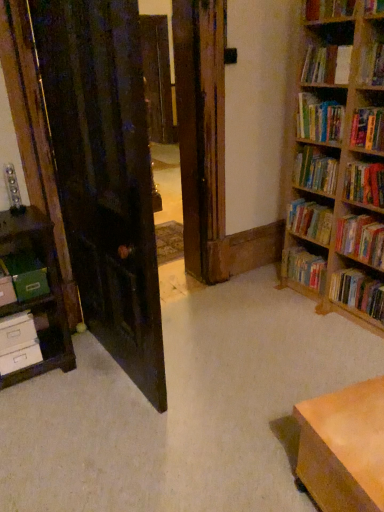
This screenshot has width=384, height=512. I want to click on vacant space underneath hardcover book at upper right, the 8th book when ordered from bottom to top (from a real-world perspective), so click(329, 93).